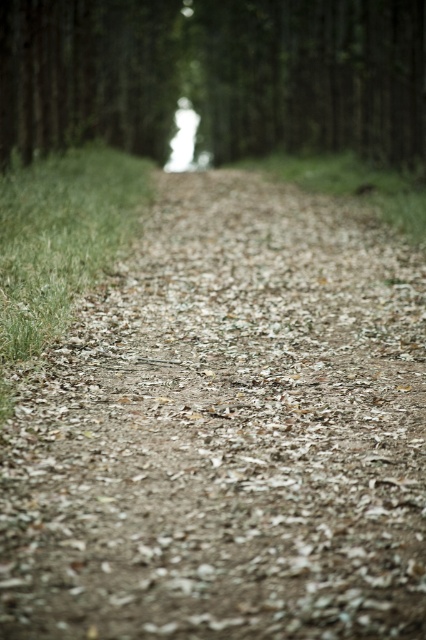
Question: Does brown dirt track at center come in front of green matte tree at center?

Choices:
 (A) yes
 (B) no

Answer: (A)

Question: Is brown dirt track at center positioned before green matte tree at center?

Choices:
 (A) no
 (B) yes

Answer: (B)

Question: Can you confirm if brown dirt track at center is thinner than green matte tree at center?

Choices:
 (A) yes
 (B) no

Answer: (A)

Question: Which of the following is the closest to the observer?

Choices:
 (A) green matte tree at center
 (B) brown dirt track at center

Answer: (B)